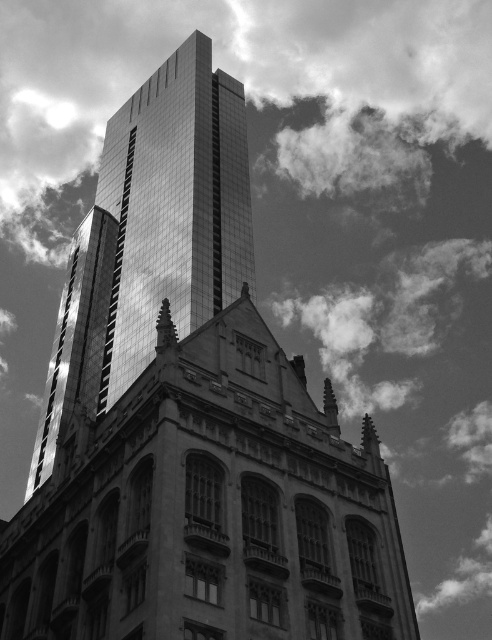
Between reflective glass skyscraper at center and smooth glass spire at center, which one appears on the right side from the viewer's perspective?

smooth glass spire at center is more to the right.

Identify the location of reflective glass skyscraper at center. The image size is (492, 640). (174, 205).